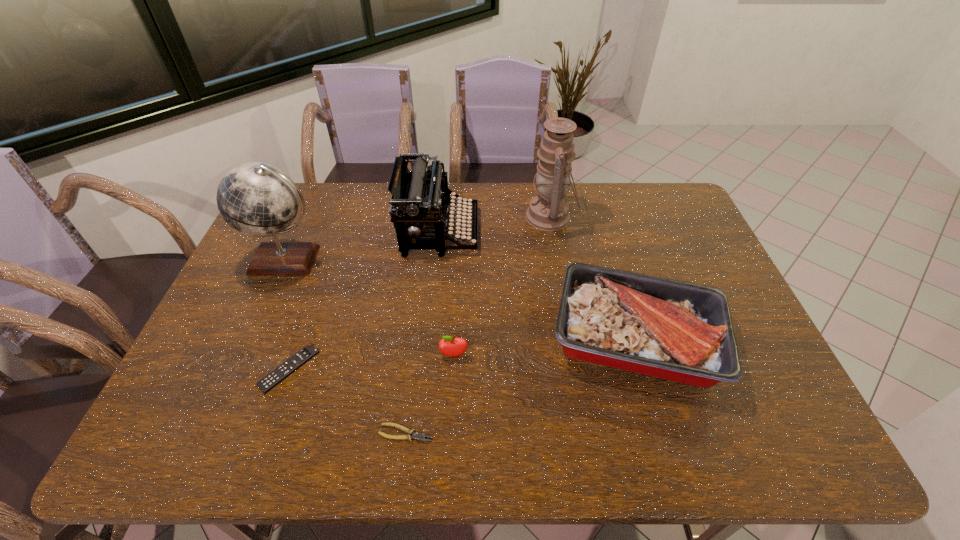
Identify the location of oil lamp. (548, 211).

This screenshot has width=960, height=540. What are the coordinates of `globe` in the screenshot? It's located at (256, 199).

This screenshot has height=540, width=960. What are the coordinates of `typewriter` in the screenshot? It's located at (420, 198).

At what (x,y) coordinates should I click in order to perform the action: click on tray. Please return your answer as a coordinate pair (x, y). Looking at the image, I should click on (678, 331).

At what (x,y) coordinates should I click in order to perform the action: click on the third shortest object. Please return your answer as a coordinate pair (x, y). The height and width of the screenshot is (540, 960). Looking at the image, I should click on (449, 346).

The image size is (960, 540). I want to click on remote control, so click(x=308, y=352).

Where is `the nearest object`? The height and width of the screenshot is (540, 960). the nearest object is located at coordinates (419, 436).

Identify the location of vacant space located on the left of the oil lamp. This screenshot has height=540, width=960. (466, 217).

The width and height of the screenshot is (960, 540). Find the location of `free point located at the equator of the globe`. free point located at the equator of the globe is located at coordinates (255, 333).

This screenshot has height=540, width=960. I want to click on vacant space situated on the typing side of the third tallest object, so click(x=552, y=231).